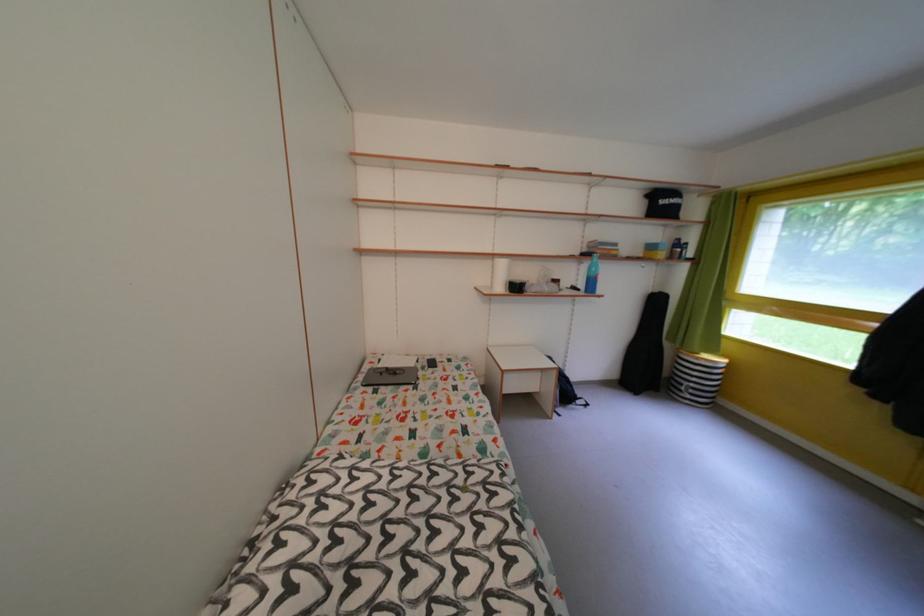
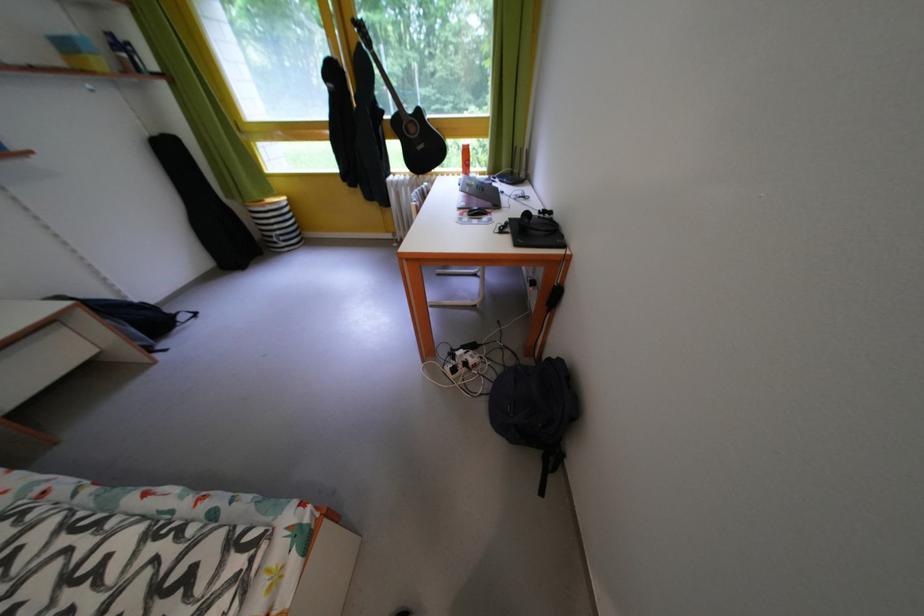
The point at (665,296) is marked in the first image. Where is the corresponding point in the second image?

(165, 139)